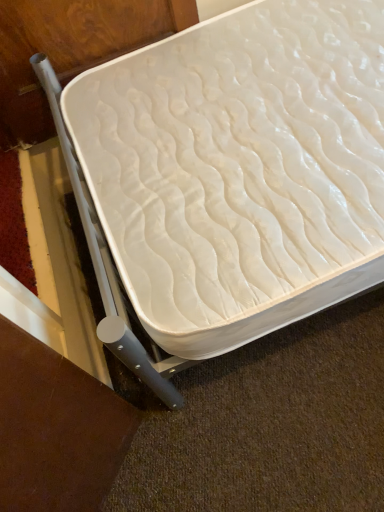
Image resolution: width=384 pixels, height=512 pixels. Identify the location of white textured mattress at center. (223, 182).

The height and width of the screenshot is (512, 384). What do you see at coordinates (223, 182) in the screenshot?
I see `white textured mattress at center` at bounding box center [223, 182].

Locate an element on the screen. The height and width of the screenshot is (512, 384). white textured mattress at center is located at coordinates (223, 182).